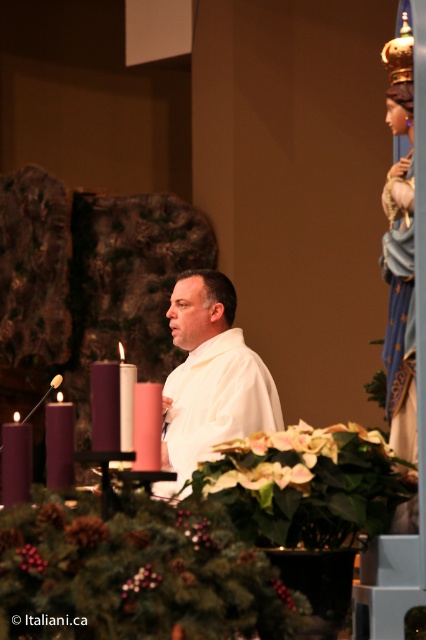
Is point (143, 387) positioned after point (132, 413)?

No, (143, 387) is in front of (132, 413).

Is matte white candle at left bigger than pink wax candle at center?

Actually, matte white candle at left might be smaller than pink wax candle at center.

Does point (134, 412) come closer to viewer compared to point (123, 406)?

Yes, point (134, 412) is closer to viewer.

Where is `matte white candle at left`? The width and height of the screenshot is (426, 640). matte white candle at left is located at coordinates (146, 426).

Can you confirm if purple matte candle at center is positioned to the right of purple wax candle at left?

Yes, purple matte candle at center is to the right of purple wax candle at left.

Does purple matte candle at center appear under purple wax candle at left?

No.

You are a GUI agent. You are given a task and a screenshot of the screen. Output one action in this format:
    pyautogui.click(x=<x>, y=<y>)
    Task: Click on the purple matte candle at center
    
    Given the screenshot: What is the action you would take?
    pyautogui.click(x=104, y=404)

The height and width of the screenshot is (640, 426). I want to click on white matte/soft fabric at center, so (x=210, y=378).

Between white matte/soft fabric at center and purple wax candle at left, which one is positioned higher?

purple wax candle at left

The width and height of the screenshot is (426, 640). What are the coordinates of `white matte/soft fabric at center` in the screenshot? It's located at (210, 378).